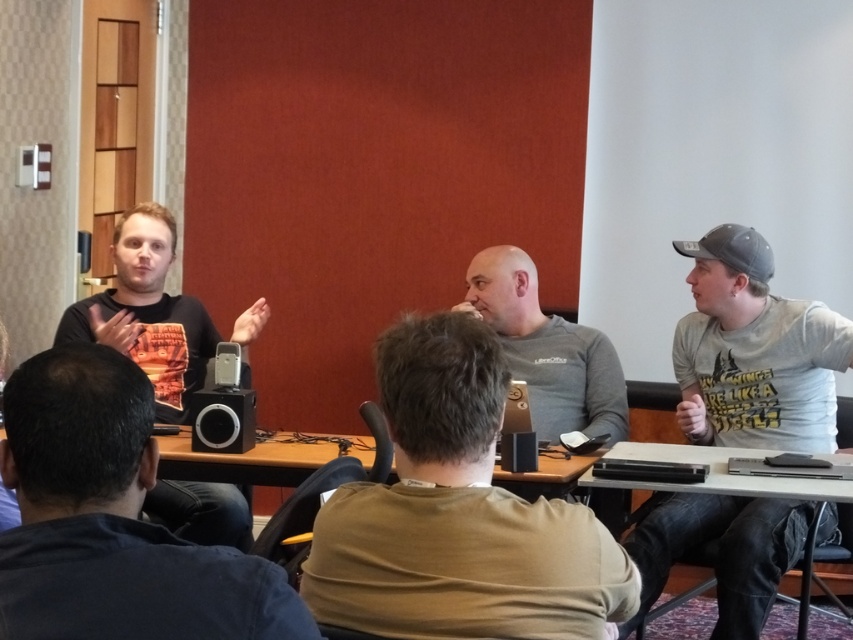
Question: Is matte black laptop at left positioned at the back of matte black shirt at left?

Choices:
 (A) yes
 (B) no

Answer: (B)

Question: Which object appears farthest from the camera in this image?

Choices:
 (A) matte black laptop at left
 (B) satin black speaker at center
 (C) gray matte shirt at center

Answer: (C)

Question: Which object is closer to the camera taking this photo?

Choices:
 (A) black plastic table at lower center
 (B) matte black laptop at left
 (C) black plastic table at lower right
 (D) matte black shirt at left

Answer: (B)

Question: Does satin black speaker at center appear under black matte laptop at center?

Choices:
 (A) yes
 (B) no

Answer: (B)

Question: Which point appears closest to the camera in this image?

Choices:
 (A) (222, 420)
 (B) (9, 573)
 (C) (537, 458)
 (D) (543, 483)

Answer: (B)

Question: Is gray matte shirt at center to the left of satin black speaker at center from the viewer's perspective?

Choices:
 (A) yes
 (B) no

Answer: (B)